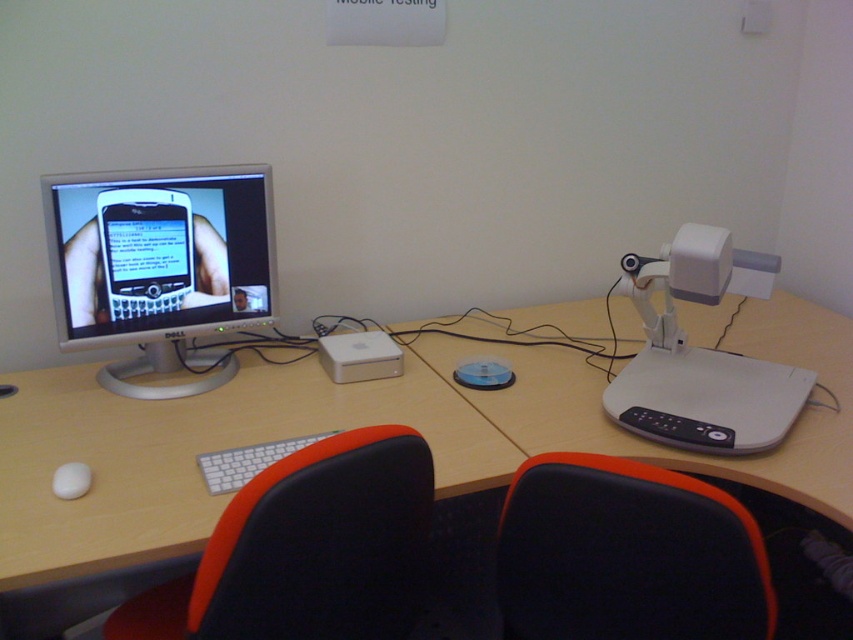
Question: Estimate the real-world distances between objects in this image. Which object is farther from the white matte mouse at lower left?

Choices:
 (A) white matte keyboard at center
 (B) black leather chair at lower center
 (C) black fabric chair at lower center

Answer: (B)

Question: Which object appears farthest from the camera in this image?

Choices:
 (A) black fabric chair at lower center
 (B) white matte keyboard at center
 (C) light brown wood table at center

Answer: (B)

Question: Is white plastic projector at upper right positioned behind white matte mouse at lower left?

Choices:
 (A) yes
 (B) no

Answer: (A)

Question: Estimate the real-world distances between objects in this image. Which object is closer to the light brown wood table at center?

Choices:
 (A) black leather chair at lower center
 (B) black fabric chair at lower center
 (C) white plastic table at center
 (D) white plastic projector at upper right

Answer: (C)

Question: Does satin silver monitor at upper left lie in front of white matte keyboard at center?

Choices:
 (A) no
 (B) yes

Answer: (A)

Question: Does light brown wood table at center have a smaller size compared to white plastic projector at upper right?

Choices:
 (A) yes
 (B) no

Answer: (B)